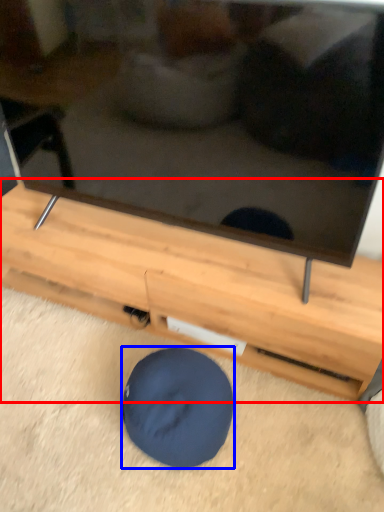
Question: Which object appears closest to the camera in this image, furniture (highlighted by a red box) or dog bed (highlighted by a blue box)?

Choices:
 (A) furniture
 (B) dog bed

Answer: (B)